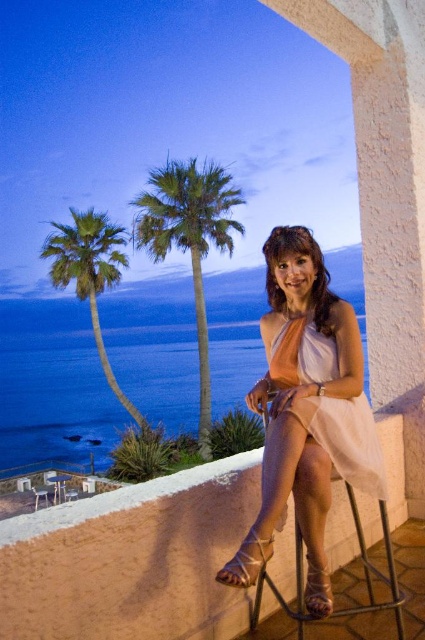
Question: Can you confirm if white satin dress at center is positioned to the left of matte brown sandal at lower center?

Choices:
 (A) no
 (B) yes

Answer: (A)

Question: From the image, what is the correct spatial relationship of white sheer dress at center in relation to metallic silver bar stool at lower left?

Choices:
 (A) below
 (B) above

Answer: (B)

Question: Which object is farther from the camera taking this photo?

Choices:
 (A) matte brown sandal at lower center
 (B) green leafy palm tree at center
 (C) metallic silver bar stool at lower left

Answer: (B)

Question: Does metallic silver bar stool at lower right appear over metallic silver bar stool at lower left?

Choices:
 (A) no
 (B) yes

Answer: (B)

Question: Considering the real-world distances, which object is farthest from the green leafy palm tree at center?

Choices:
 (A) satin beige sandal at lower center
 (B) matte brown sandal at lower center

Answer: (B)

Question: Which point is closer to the camera?

Choices:
 (A) green leafy palm tree at left
 (B) satin beige sandal at lower center

Answer: (B)